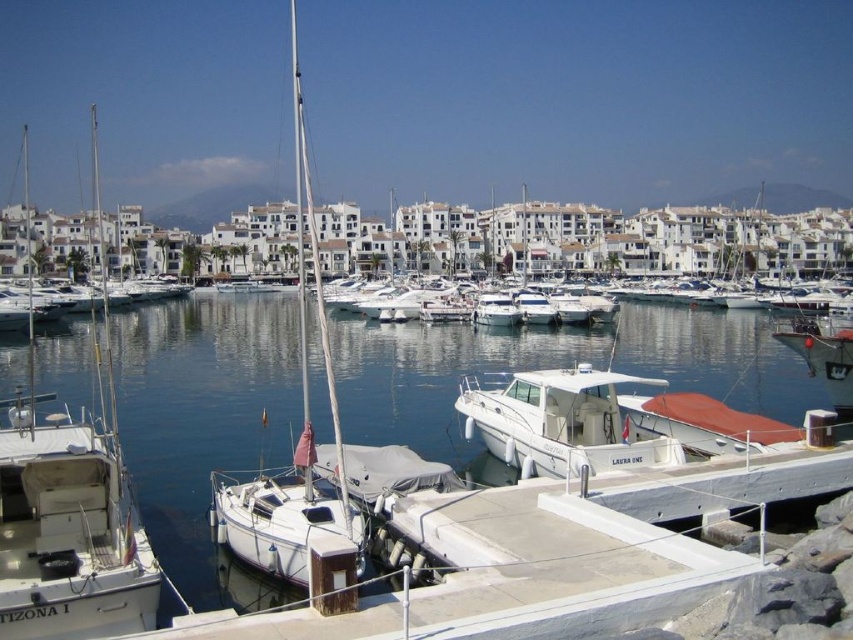
Can you confirm if white glossy motorboat at center is shorter than clear blue water at center?

Yes, white glossy motorboat at center is shorter than clear blue water at center.

Locate an element on the screen. This screenshot has width=853, height=640. white glossy motorboat at center is located at coordinates pyautogui.click(x=606, y=422).

Is point (570, 436) closer to viewer compared to point (30, 444)?

No, (570, 436) is further to viewer.

Image resolution: width=853 pixels, height=640 pixels. I want to click on white glossy motorboat at center, so click(x=606, y=422).

How distant is white matte sailboat at left from clear blue water at center?

white matte sailboat at left and clear blue water at center are 111.54 feet apart.

Is point (26, 480) farther from camera compared to point (534, 406)?

No.

Locate an element on the screen. Image resolution: width=853 pixels, height=640 pixels. white matte sailboat at left is located at coordinates (70, 502).

Is white matte sailboat at center closer to camera compared to clear blue water at center?

No, it is behind clear blue water at center.

Who is positioned more to the right, white matte sailboat at center or clear blue water at center?

clear blue water at center

Where is `white matte sailboat at center`? This screenshot has width=853, height=640. white matte sailboat at center is located at coordinates (299, 436).